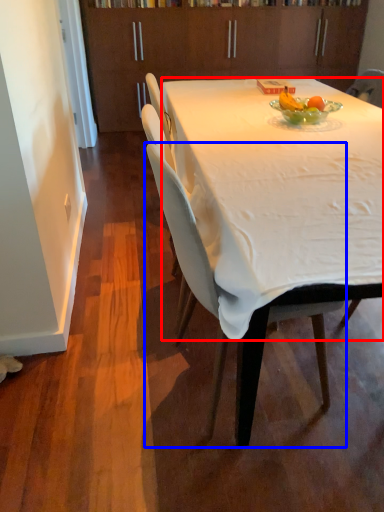
Question: Which of the following is the farthest to the observer, desk (highlighted by a red box) or chair (highlighted by a blue box)?

Choices:
 (A) desk
 (B) chair

Answer: (B)